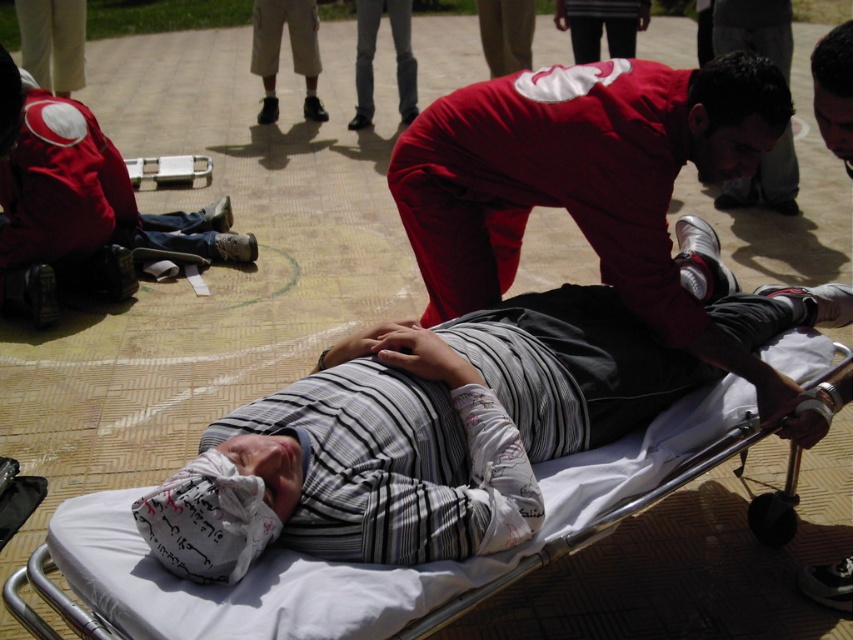
You are a first responder arriving at the scene. You see the white fabric stretcher at center and the striped fabric shirt at center. Which object is higher in elevation?

The white fabric stretcher at center is taller than the striped fabric shirt at center, so the white fabric stretcher at center is higher in elevation.

You are a trainee in the medical emergency course. You see a person lying on a stretcher covered with a white sheet and a point marked at coordinate (577, 172). What is the location of the matte red uniform relative to the stretcher?

The point (577, 172) indicates the location of the matte red uniform at center, so the matte red uniform is at the center relative to the stretcher.

You are a participant in an emergency training exercise and need to locate your equipment. You see the matte red uniform at center and the matte red backpack at upper left. Which one is closer to you?

The matte red uniform at center is closer to you because it is in front of the matte red backpack at upper left.